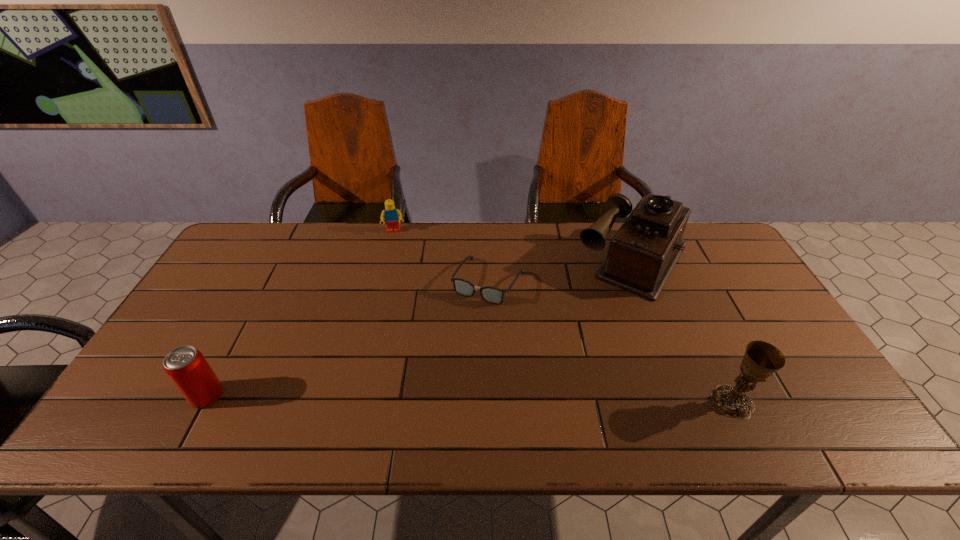
Find the location of a particular element. the leftmost object is located at coordinates click(187, 368).

The width and height of the screenshot is (960, 540). Find the location of `the third tallest object`. the third tallest object is located at coordinates (187, 368).

Locate an element on the screen. Image resolution: width=960 pixels, height=540 pixels. chalice is located at coordinates (761, 359).

Find the location of `spectacles`. spectacles is located at coordinates (493, 295).

This screenshot has width=960, height=540. In order to click on the third object from right to left in this screenshot , I will do `click(493, 295)`.

You are a GUI agent. You are given a task and a screenshot of the screen. Output one action in this format:
    pyautogui.click(x=<x>, y=<y>)
    Task: Click on the phonograph_record
    The image size is (960, 540).
    Given the screenshot: What is the action you would take?
    pyautogui.click(x=642, y=254)

Find the location of `the fourth object from right to left`. the fourth object from right to left is located at coordinates tap(392, 216).

The image size is (960, 540). I want to click on Lego, so click(x=392, y=216).

You are a GUI agent. You are given a task and a screenshot of the screen. Output one action in this format:
    pyautogui.click(x=<x>, y=<y>)
    Task: Click on the vacant point located on the right of the leftmost object
    This screenshot has width=960, height=540.
    Given the screenshot: What is the action you would take?
    pyautogui.click(x=295, y=395)

This screenshot has height=540, width=960. Identify the location of free spot located on the back of the chalice. (709, 355).